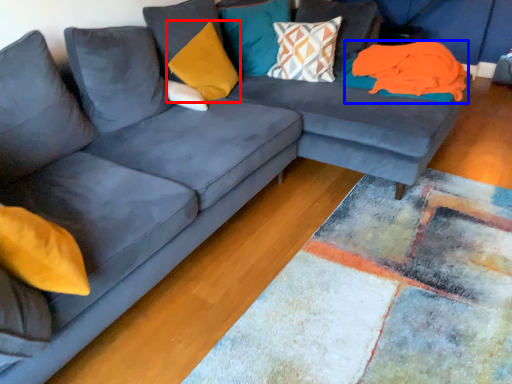
Question: Which object appears closest to the camera in this image, pillow (highlighted by a red box) or material (highlighted by a blue box)?

Choices:
 (A) pillow
 (B) material

Answer: (A)